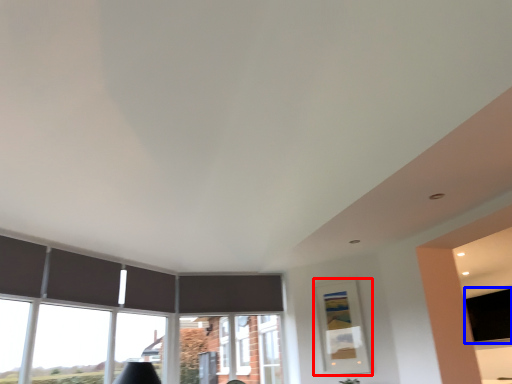
Question: Which point is closer to the camera, picture frame (highlighted by a red box) or window screen (highlighted by a blue box)?

Choices:
 (A) picture frame
 (B) window screen

Answer: (A)